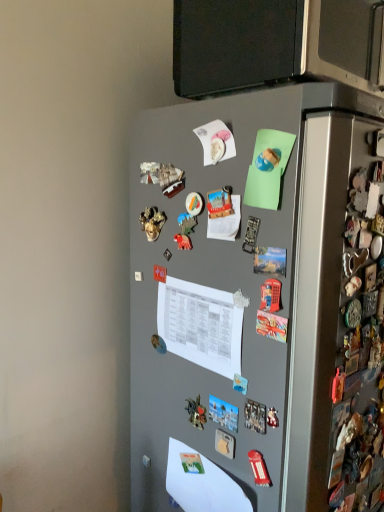
You are a GUI agent. You are given a task and a screenshot of the screen. Output one action in this format:
    pyautogui.click(x=<x>, y=<y>)
    Task: Click on the white paper at lower center, arranged as the 2th paper when viewed from the top
    Image resolution: width=384 pixels, height=512 pixels.
    Given the screenshot: What is the action you would take?
    pyautogui.click(x=201, y=483)

The image size is (384, 512). Find the location of `gray matte refrigerator at center`. gray matte refrigerator at center is located at coordinates (258, 302).

Identify the location of white paper at lower center, which is the 1th paper in bottom-to-top order. Image resolution: width=384 pixels, height=512 pixels. (201, 483).

From the picture: Is white paper at lower center, which is the 1th paper in bottom-to-top order, aimed at satin black microwave at upper center?

No, white paper at lower center, which is the 1th paper in bottom-to-top order, does not turn towards satin black microwave at upper center.

Is white paper at lower center, which is the 1th paper in bottom-to-top order, not close to satin black microwave at upper center?

Yes.

Considering the relative sizes of white paper at lower center, arranged as the 2th paper when viewed from the top, and satin black microwave at upper center in the image provided, is white paper at lower center, arranged as the 2th paper when viewed from the top, bigger than satin black microwave at upper center?

No.

From a real-world perspective, is white paper at lower center, which is the 1th paper in bottom-to-top order, positioned over satin black microwave at upper center based on gravity?

Incorrect, from a real-world perspective, white paper at lower center, which is the 1th paper in bottom-to-top order, is lower than satin black microwave at upper center.

Are white paper at center, positioned as the first paper in top-to-bottom order, and gray matte refrigerator at center beside each other?

They are not placed beside each other.

From a real-world perspective, is white paper at center, positioned as the first paper in top-to-bottom order, on gray matte refrigerator at center?

Indeed, from a real-world perspective, white paper at center, positioned as the first paper in top-to-bottom order, stands above gray matte refrigerator at center.

Would you say white paper at center, which is the second paper in bottom-to-top order, is outside gray matte refrigerator at center?

No, white paper at center, which is the second paper in bottom-to-top order, is not entirely external to gray matte refrigerator at center.

Between white paper at center, positioned as the first paper in top-to-bottom order, and gray matte refrigerator at center, which one has smaller size?

white paper at center, positioned as the first paper in top-to-bottom order.

From the image's perspective, is satin black microwave at upper center located above or below gray matte refrigerator at center?

Clearly, from the image's perspective, satin black microwave at upper center is above gray matte refrigerator at center.

Locate an element on the screen. back above the gray matte refrigerator at center (from the image's perspective) is located at coordinates (276, 44).

Considering the points (289, 71) and (317, 486), which point is behind, point (289, 71) or point (317, 486)?

Point (317, 486)

Is satin black microwave at upper center taller or shorter than gray matte refrigerator at center?

Clearly, satin black microwave at upper center is shorter compared to gray matte refrigerator at center.

Considering the sizes of objects white paper at center, which is the second paper in bottom-to-top order, and white paper at lower center, arranged as the 2th paper when viewed from the top, in the image provided, who is shorter, white paper at center, which is the second paper in bottom-to-top order, or white paper at lower center, arranged as the 2th paper when viewed from the top,?

With less height is white paper at lower center, arranged as the 2th paper when viewed from the top.

Which object is further away from the camera, white paper at center, positioned as the first paper in top-to-bottom order, or white paper at lower center, which is the 1th paper in bottom-to-top order?

white paper at lower center, which is the 1th paper in bottom-to-top order, is further from the camera.

Is white paper at center, which is the second paper in bottom-to-top order, oriented away from white paper at lower center, arranged as the 2th paper when viewed from the top?

white paper at center, which is the second paper in bottom-to-top order, does not have its back to white paper at lower center, arranged as the 2th paper when viewed from the top.

Considering the sizes of objects white paper at lower center, which is the 1th paper in bottom-to-top order, and white paper at center, positioned as the first paper in top-to-bottom order, in the image provided, who is shorter, white paper at lower center, which is the 1th paper in bottom-to-top order, or white paper at center, positioned as the first paper in top-to-bottom order,?

white paper at lower center, which is the 1th paper in bottom-to-top order, is shorter.

Where is `paper that is in front of the white paper at lower center, which is the 1th paper in bottom-to-top order`? This screenshot has width=384, height=512. paper that is in front of the white paper at lower center, which is the 1th paper in bottom-to-top order is located at coordinates (201, 325).

Considering their positions, is white paper at lower center, which is the 1th paper in bottom-to-top order, located in front of or behind white paper at center, which is the second paper in bottom-to-top order?

Clearly, white paper at lower center, which is the 1th paper in bottom-to-top order, is behind white paper at center, which is the second paper in bottom-to-top order.

Can you confirm if white paper at lower center, arranged as the 2th paper when viewed from the top, is bigger than white paper at center, which is the second paper in bottom-to-top order?

Indeed, white paper at lower center, arranged as the 2th paper when viewed from the top, has a larger size compared to white paper at center, which is the second paper in bottom-to-top order.

Looking at their sizes, would you say white paper at lower center, which is the 1th paper in bottom-to-top order, is wider or thinner than gray matte refrigerator at center?

Clearly, white paper at lower center, which is the 1th paper in bottom-to-top order, has less width compared to gray matte refrigerator at center.

Considering the relative sizes of white paper at lower center, which is the 1th paper in bottom-to-top order, and gray matte refrigerator at center in the image provided, is white paper at lower center, which is the 1th paper in bottom-to-top order, bigger than gray matte refrigerator at center?

Actually, white paper at lower center, which is the 1th paper in bottom-to-top order, might be smaller than gray matte refrigerator at center.

Who is shorter, white paper at lower center, which is the 1th paper in bottom-to-top order, or gray matte refrigerator at center?

Standing shorter between the two is white paper at lower center, which is the 1th paper in bottom-to-top order.

Is white paper at lower center, which is the 1th paper in bottom-to-top order, not near gray matte refrigerator at center?

They are positioned close to each other.

Is satin black microwave at upper center located within gray matte refrigerator at center?

Definitely not — satin black microwave at upper center is not inside gray matte refrigerator at center.

Between gray matte refrigerator at center and satin black microwave at upper center, which one appears on the left side from the viewer's perspective?

gray matte refrigerator at center is more to the left.

From the picture: Can you confirm if gray matte refrigerator at center is smaller than satin black microwave at upper center?

Actually, gray matte refrigerator at center might be larger than satin black microwave at upper center.

In the scene shown: Considering the sizes of objects gray matte refrigerator at center and satin black microwave at upper center in the image provided, who is thinner, gray matte refrigerator at center or satin black microwave at upper center?

With smaller width is satin black microwave at upper center.

The height and width of the screenshot is (512, 384). I want to click on back above the white paper at lower center, arranged as the 2th paper when viewed from the top (from the image's perspective), so click(x=276, y=44).

The image size is (384, 512). I want to click on refrigerator to the right of white paper at center, positioned as the first paper in top-to-bottom order, so click(x=258, y=302).

When comparing their distances from gray matte refrigerator at center, does satin black microwave at upper center or white paper at lower center, arranged as the 2th paper when viewed from the top, seem further?

The object further to gray matte refrigerator at center is satin black microwave at upper center.

Considering their positions, is white paper at lower center, arranged as the 2th paper when viewed from the top, positioned closer to gray matte refrigerator at center than satin black microwave at upper center?

Based on the image, white paper at lower center, arranged as the 2th paper when viewed from the top, appears to be nearer to gray matte refrigerator at center.

Looking at the image, which one is located closer to white paper at center, which is the second paper in bottom-to-top order, gray matte refrigerator at center or satin black microwave at upper center?

gray matte refrigerator at center is closer to white paper at center, which is the second paper in bottom-to-top order.

From the image, which object appears to be nearer to white paper at center, which is the second paper in bottom-to-top order, white paper at lower center, which is the 1th paper in bottom-to-top order, or satin black microwave at upper center?

Among the two, white paper at lower center, which is the 1th paper in bottom-to-top order, is located nearer to white paper at center, which is the second paper in bottom-to-top order.

From the image, which object appears to be farther from satin black microwave at upper center, white paper at lower center, arranged as the 2th paper when viewed from the top, or white paper at center, which is the second paper in bottom-to-top order?

white paper at lower center, arranged as the 2th paper when viewed from the top.

Looking at this image, based on their spatial positions, is satin black microwave at upper center or gray matte refrigerator at center further from white paper at lower center, arranged as the 2th paper when viewed from the top?

satin black microwave at upper center.

Based on their spatial positions, is gray matte refrigerator at center or white paper at center, which is the second paper in bottom-to-top order, closer to satin black microwave at upper center?

gray matte refrigerator at center is positioned closer to the anchor satin black microwave at upper center.

From the image, which object appears to be nearer to satin black microwave at upper center, gray matte refrigerator at center or white paper at lower center, which is the 1th paper in bottom-to-top order?

gray matte refrigerator at center is positioned closer to the anchor satin black microwave at upper center.

Where is `paper that lies between satin black microwave at upper center and gray matte refrigerator at center from top to bottom`? paper that lies between satin black microwave at upper center and gray matte refrigerator at center from top to bottom is located at coordinates (201, 325).

At what (x,y) coordinates should I click in order to perform the action: click on paper that lies between satin black microwave at upper center and white paper at lower center, arranged as the 2th paper when viewed from the top, from top to bottom. Please return your answer as a coordinate pair (x, y). The width and height of the screenshot is (384, 512). Looking at the image, I should click on (201, 325).

Find the location of a particular element. The image size is (384, 512). refrigerator between white paper at center, which is the second paper in bottom-to-top order, and white paper at lower center, which is the 1th paper in bottom-to-top order, in the vertical direction is located at coordinates (258, 302).

Find the location of a particular element. refrigerator that lies between satin black microwave at upper center and white paper at lower center, which is the 1th paper in bottom-to-top order, from top to bottom is located at coordinates (258, 302).